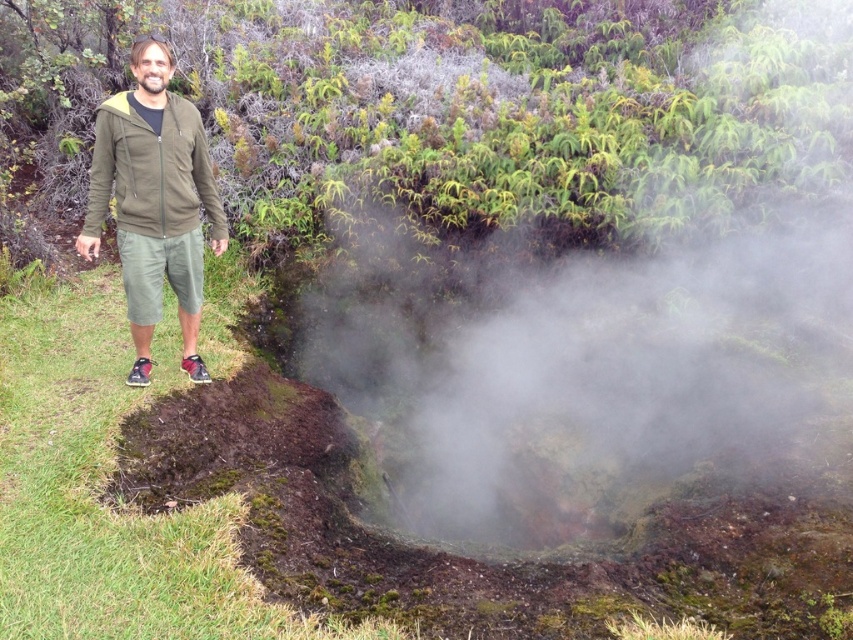
You are standing at the point labeled point (x=148, y=337) and want to walk to the point labeled point (x=370, y=404). Given that the path between them is clear, will you have to walk towards or away from the person in the green zip up hoodie?

You will have to walk away from the person in the green zip up hoodie because point (x=370, y=404) is behind point (x=148, y=337) relative to the person.

You are a hiker who wants to avoid the white misty steam at center. Which direction should you move relative to the matte olive green jacket at left?

The white misty steam at center is below the matte olive green jacket at left, so to avoid it, you should move away from the center towards the upper area relative to the matte olive green jacket at left.